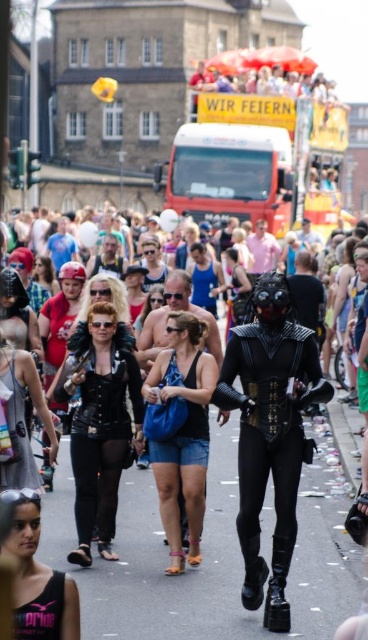
You are a photographer trying to capture both the matte black costume at center and the matte black tank top at center in a single shot. Considering their sizes, which object should you focus on to ensure both are clearly visible in the frame?

The matte black costume at center is larger in size than the matte black tank top at center, so focusing on the matte black costume at center would allow the smaller matte black tank top at center to also be clearly visible in the frame.

From the picture: You are a photographer trying to capture a photo of the matte black costume at center and the white glossy truck at center. Based on their sizes, which object should you focus on first to ensure it appears larger in the photo?

The matte black costume at center has a greater height compared to the white glossy truck at center, so you should focus on the matte black costume at center first to ensure it appears larger in the photo.

You are a photographer trying to capture a photo of the white glossy truck at center without including the matte black costume at center in the frame. Based on their positions, can you position yourself in a way to achieve this?

The matte black costume at center is to the right of the white glossy truck at center, so if you position yourself to the left side of the white glossy truck at center, you can capture it without the matte black costume at center in the frame.